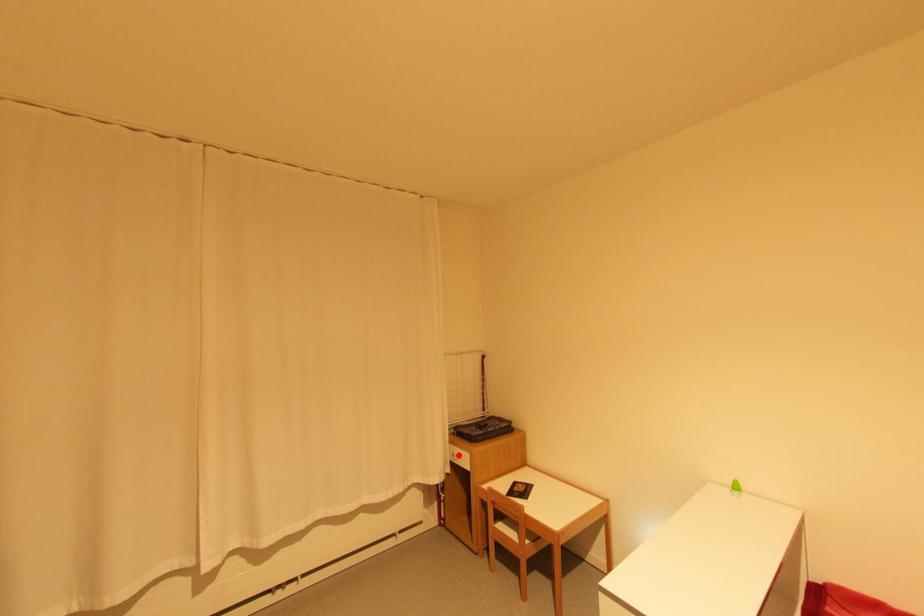
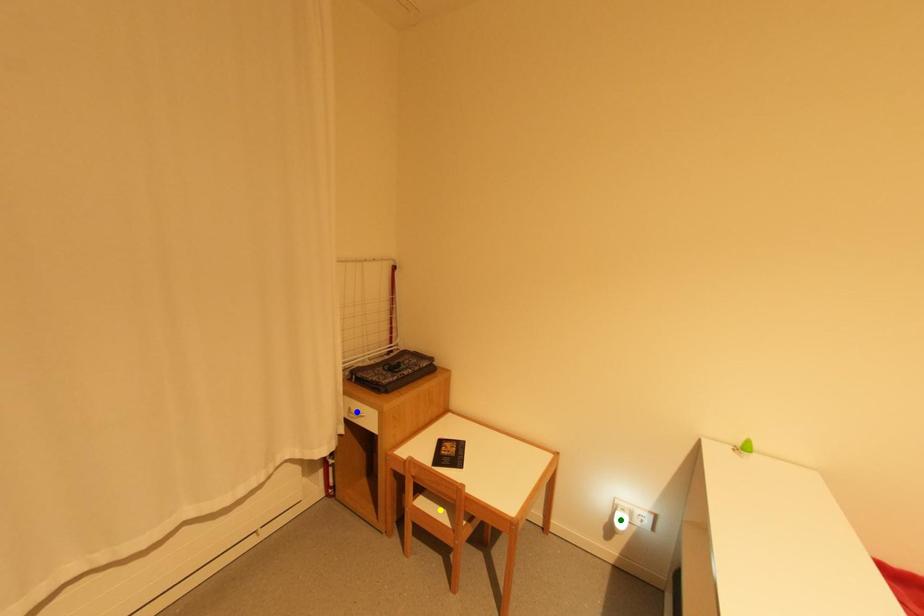
Question: I am providing you with two images of the same scene from different viewpoints. A red point is marked on the first image. You are given multiple points on the second image. Which point in image 2 is actually the same real-world point as the red point in image 1?

Choices:
 (A) green point
 (B) yellow point
 (C) blue point

Answer: (C)